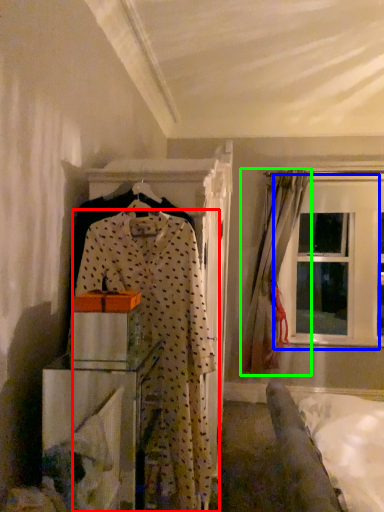
Question: Which object is positioned closest to fancy dress (highlighted by a red box)? Select from window (highlighted by a blue box) and curtain (highlighted by a green box).

Choices:
 (A) window
 (B) curtain

Answer: (B)